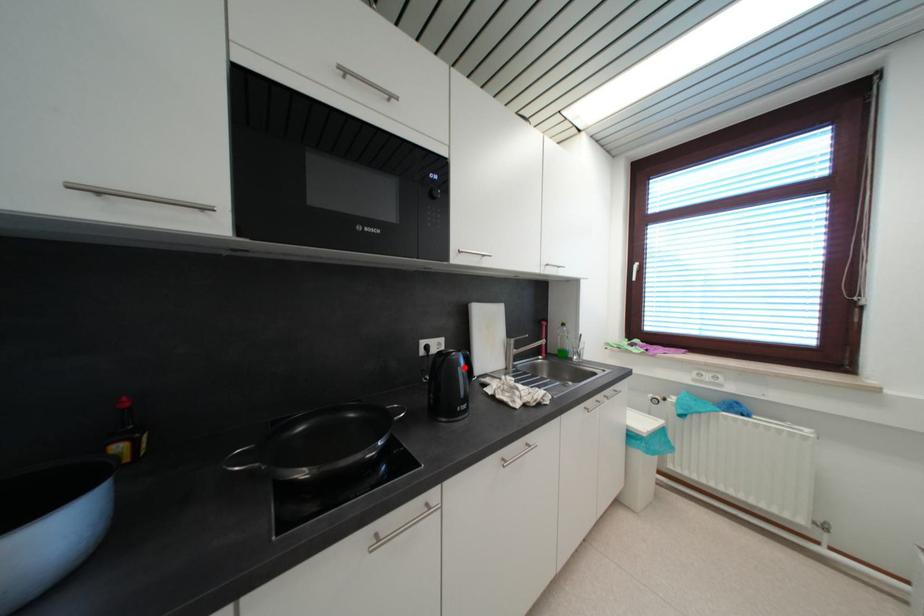
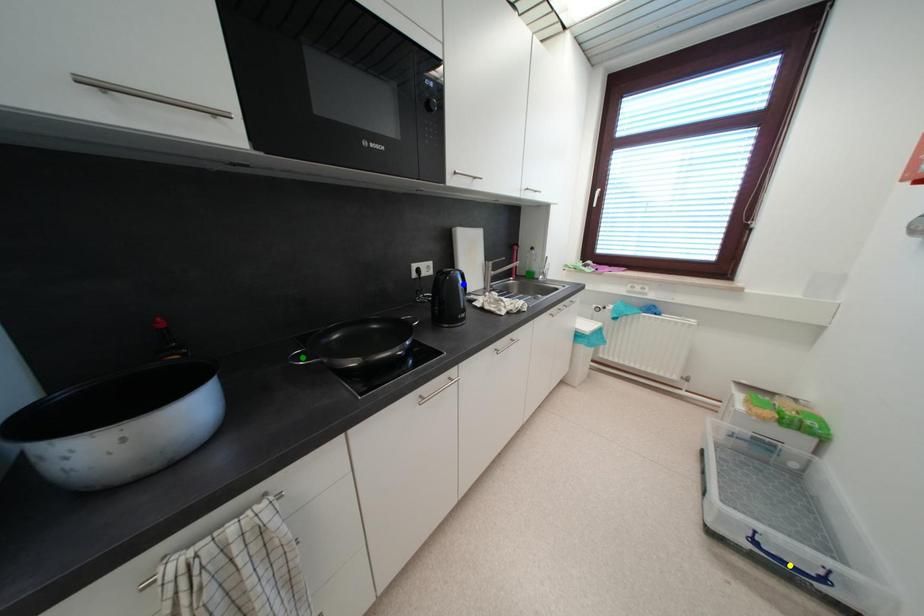
Question: I am providing you with two images of the same scene from different viewpoints. A red point is marked on the first image. You are given multiple points on the second image. Can you choose the point in image 2 that corresponds to the point in image 1?

Choices:
 (A) yellow point
 (B) blue point
 (C) green point

Answer: (B)